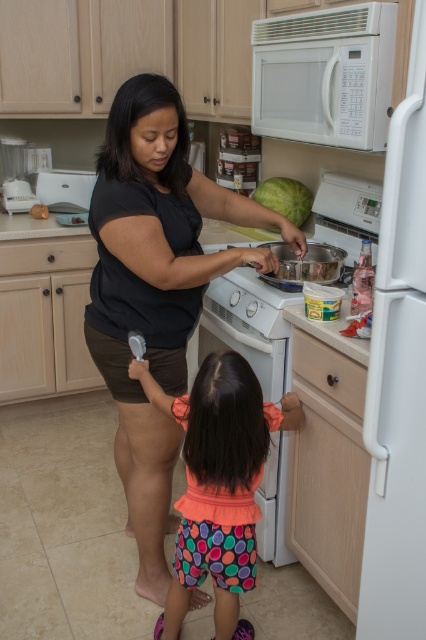
What is the 2D coordinate of the multicolored fabric shorts at lower center in the image?

The 2D coordinate of the multicolored fabric shorts at lower center is at point (218,480).

You are trying to reach the white matte microwave at upper center and the white plastic blender at left to prepare a snack. Which appliance is taller?

The white matte microwave at upper center is taller than the white plastic blender at left.

You are a home chef preparing a meal and need to use both the white matte microwave at upper center and the white plastic blender at left. Based on their positions, which appliance should you reach for first if you want to minimize movement between them?

The white plastic blender at left should be reached for first since the white matte microwave at upper center is positioned to its right, meaning the blender is closer to your starting position on the left side of the frame.